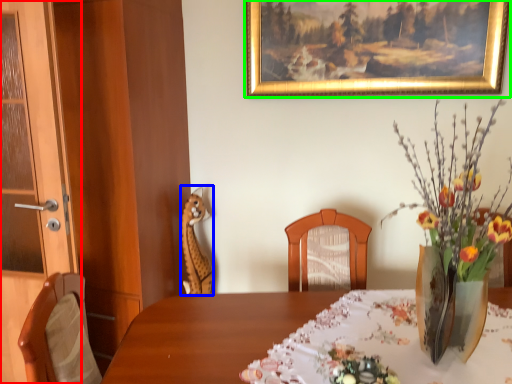
Question: Based on their relative distances, which object is nearer to door (highlighted by a red box)? Choose from animal (highlighted by a blue box) and picture frame (highlighted by a green box).

Choices:
 (A) animal
 (B) picture frame

Answer: (A)